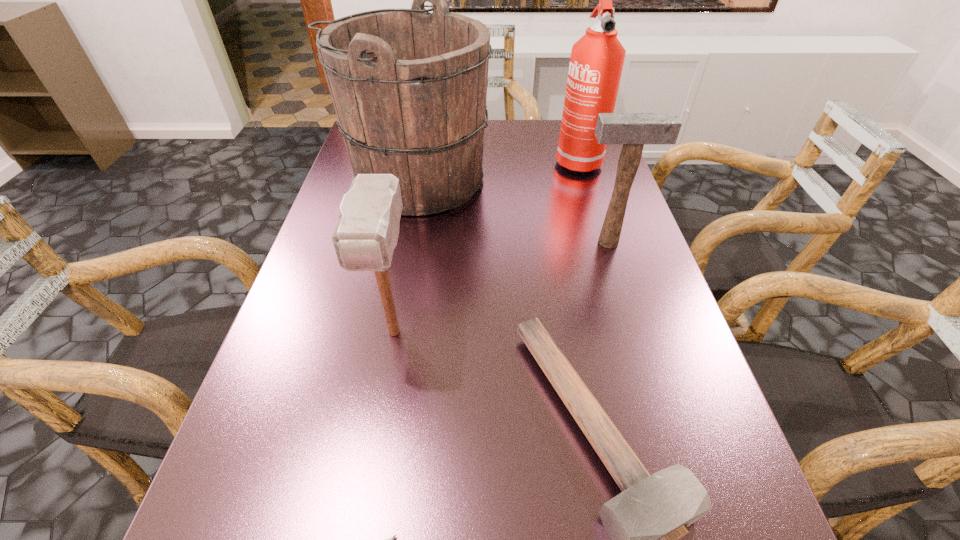
Locate an element on the screen. Image resolution: width=960 pixels, height=540 pixels. object that is positioned at the left edge is located at coordinates (409, 87).

The height and width of the screenshot is (540, 960). What are the coordinates of `fire extinguisher located in the right edge section of the desktop` in the screenshot? It's located at (596, 63).

Image resolution: width=960 pixels, height=540 pixels. Identify the location of mallet situated at the right edge. (633, 130).

Where is `object that is at the far left corner`? The height and width of the screenshot is (540, 960). object that is at the far left corner is located at coordinates (409, 87).

You are a GUI agent. You are given a task and a screenshot of the screen. Output one action in this format:
    pyautogui.click(x=<x>, y=<y>)
    Task: Click on the object positioned at the far right corner
    Image resolution: width=960 pixels, height=540 pixels.
    Given the screenshot: What is the action you would take?
    pyautogui.click(x=596, y=63)

In the image, there is a desktop. At what (x,y) coordinates should I click in order to perform the action: click on blank space at the far edge. Please return your answer as a coordinate pair (x, y). This screenshot has width=960, height=540. Looking at the image, I should click on (522, 144).

In the image, there is a desktop. At what (x,y) coordinates should I click in order to perform the action: click on free space at the left edge. Please return your answer as a coordinate pair (x, y). Looking at the image, I should click on (323, 257).

In the image, there is a desktop. Identify the location of free space at the right edge. (684, 422).

Where is `free spot between the fire extinguisher and the bucket`? The image size is (960, 540). free spot between the fire extinguisher and the bucket is located at coordinates (496, 169).

The image size is (960, 540). Identify the location of empty space that is in between the farthest mallet and the bucket. (512, 211).